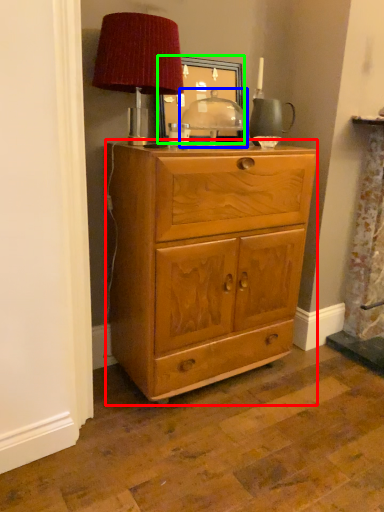
Question: Which object is the closest to the chest of drawers (highlighted by a red box)? Choose among these: table (highlighted by a blue box) or picture frame (highlighted by a green box).

Choices:
 (A) table
 (B) picture frame

Answer: (A)